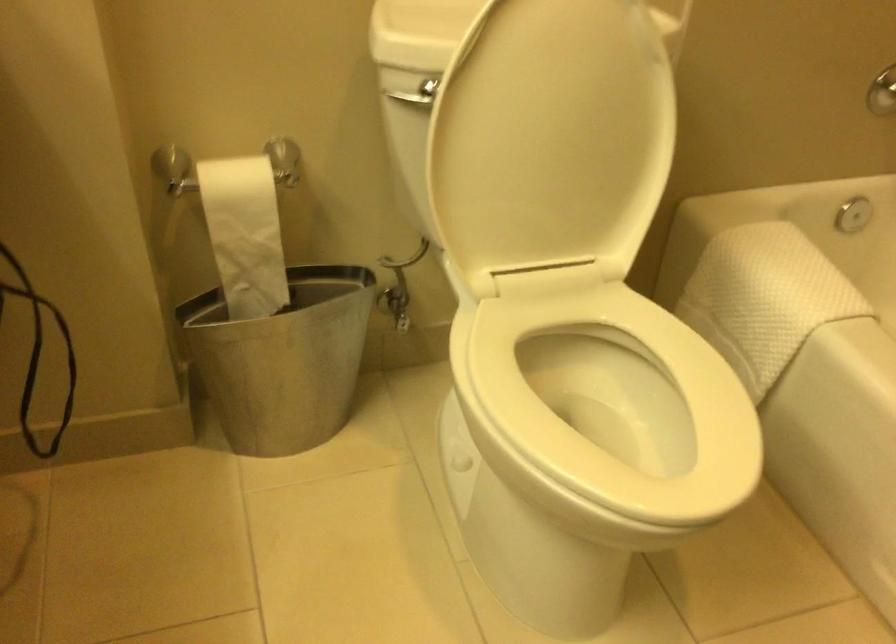
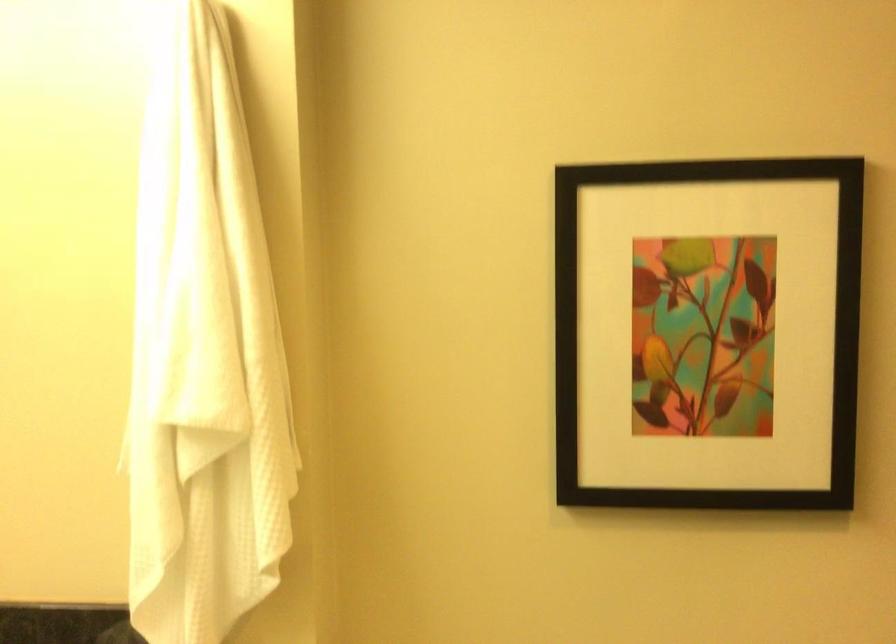
How did the camera likely rotate?

The camera rotated toward left-up.